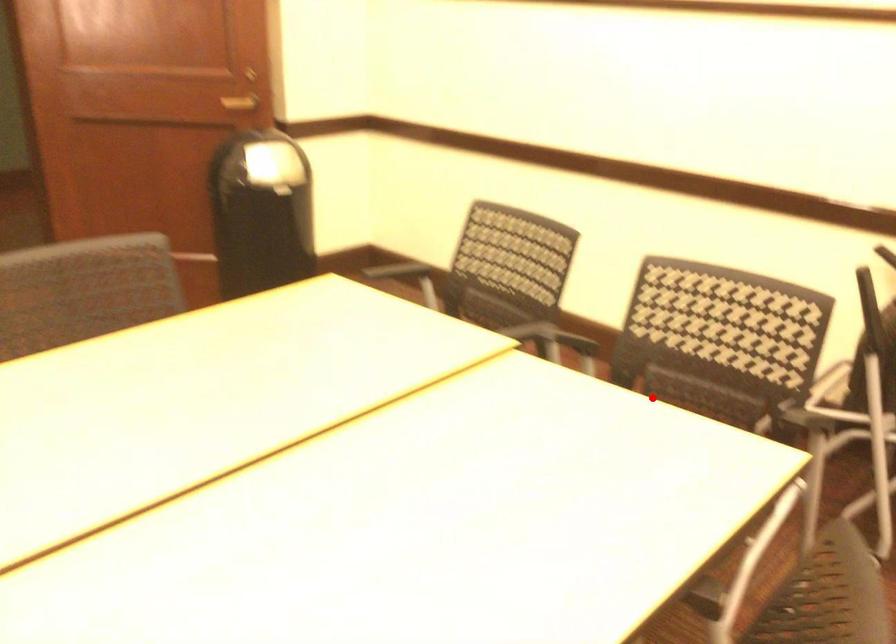
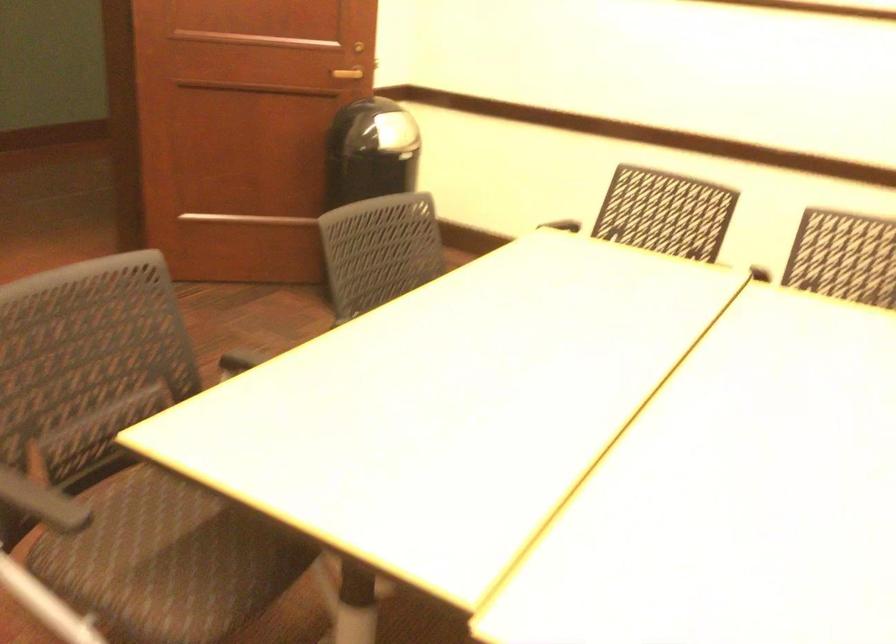
Question: I am providing you with two images of the same scene from different viewpoints. A red point is marked on the first image. Is the red point's position out of view in image 2?

Choices:
 (A) Yes
 (B) No

Answer: (A)